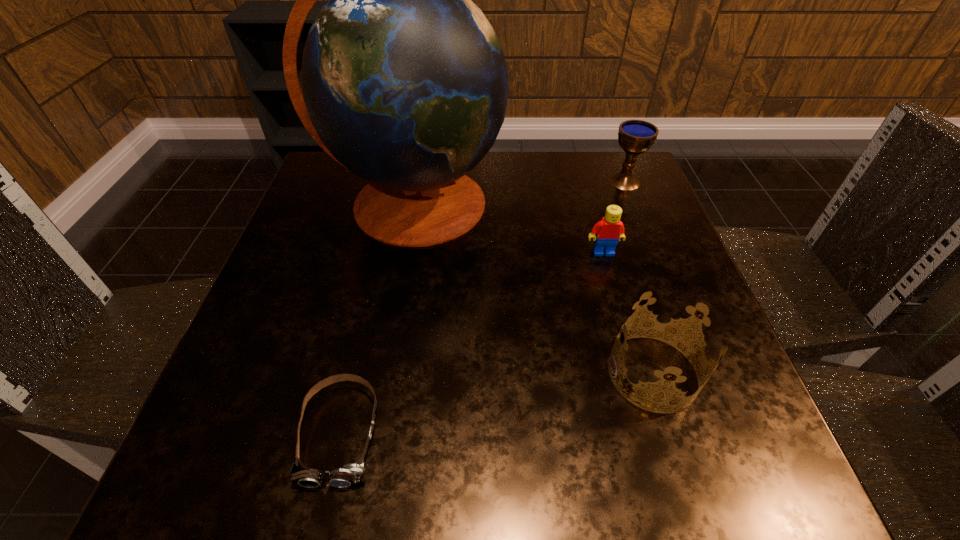
This screenshot has width=960, height=540. Find the location of `globe`. globe is located at coordinates (404, 83).

I want to click on chalice, so click(635, 137).

At what (x,y) coordinates should I click in order to perform the action: click on crown. Please return your answer as a coordinate pair (x, y). The width and height of the screenshot is (960, 540). Looking at the image, I should click on (685, 323).

Image resolution: width=960 pixels, height=540 pixels. What are the coordinates of `Lego` in the screenshot? It's located at (610, 229).

The image size is (960, 540). What are the coordinates of `goggles` in the screenshot? It's located at (349, 474).

Identify the location of free space located 0.110m with the Americas facing the viewer on the globe. The width and height of the screenshot is (960, 540). (396, 303).

Locate an element on the screen. The image size is (960, 540). free space located on the left of the chalice is located at coordinates (548, 181).

Where is `free space located on the left of the crown`? This screenshot has height=540, width=960. free space located on the left of the crown is located at coordinates (442, 373).

Find the location of `free space located on the face of the Lego`. free space located on the face of the Lego is located at coordinates (651, 421).

The height and width of the screenshot is (540, 960). In order to click on globe at the far edge in this screenshot , I will do `click(404, 83)`.